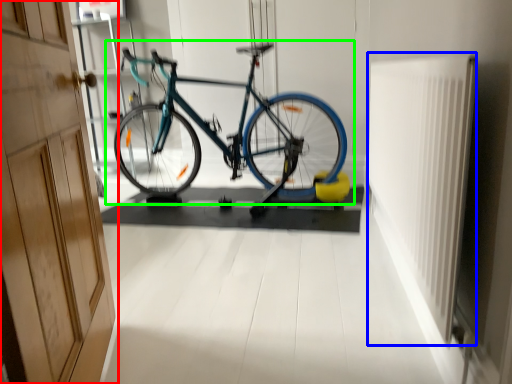
Question: Which object is the closest to the door (highlighted by a red box)? Choose among these: radiator (highlighted by a blue box) or bicycle (highlighted by a green box).

Choices:
 (A) radiator
 (B) bicycle

Answer: (A)